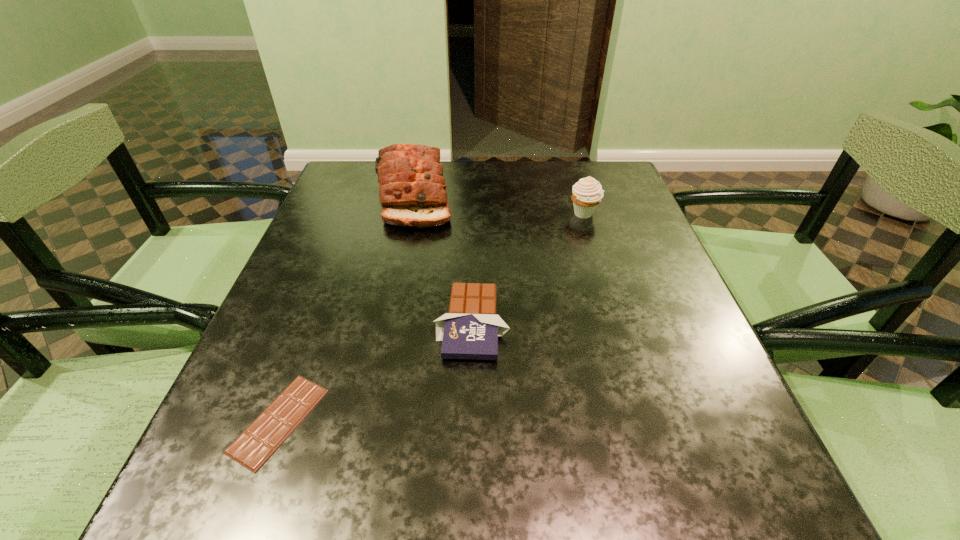
Locate an element on the screen. The width and height of the screenshot is (960, 540). free space between the bread and the nearer chocolate bar is located at coordinates (347, 307).

Where is `unoccupied position between the nearer chocolate bar and the third tallest object`? The image size is (960, 540). unoccupied position between the nearer chocolate bar and the third tallest object is located at coordinates [x=375, y=372].

Locate an element on the screen. This screenshot has width=960, height=540. vacant point located between the bread and the rightmost object is located at coordinates (499, 204).

In order to click on free point between the second shortest object and the bread in this screenshot , I will do `click(443, 259)`.

I want to click on unoccupied position between the left chocolate bar and the right chocolate bar, so click(x=375, y=372).

The height and width of the screenshot is (540, 960). I want to click on blank region between the second shortest object and the nearer chocolate bar, so click(x=375, y=372).

This screenshot has height=540, width=960. What are the coordinates of `object identified as the closest to the taller chocolate bar` in the screenshot? It's located at (268, 431).

Identify which object is located as the third nearest to the rightmost object. Please provide its 2D coordinates. Your answer should be formatted as a tuple, i.e. [(x, y)], where the tuple contains the x and y coordinates of a point satisfying the conditions above.

[(268, 431)]

Where is `free region that satisfies the following two spatial constraints: 1. on the back side of the rightmost object; 2. on the right side of the right chocolate bar`? This screenshot has height=540, width=960. free region that satisfies the following two spatial constraints: 1. on the back side of the rightmost object; 2. on the right side of the right chocolate bar is located at coordinates (473, 213).